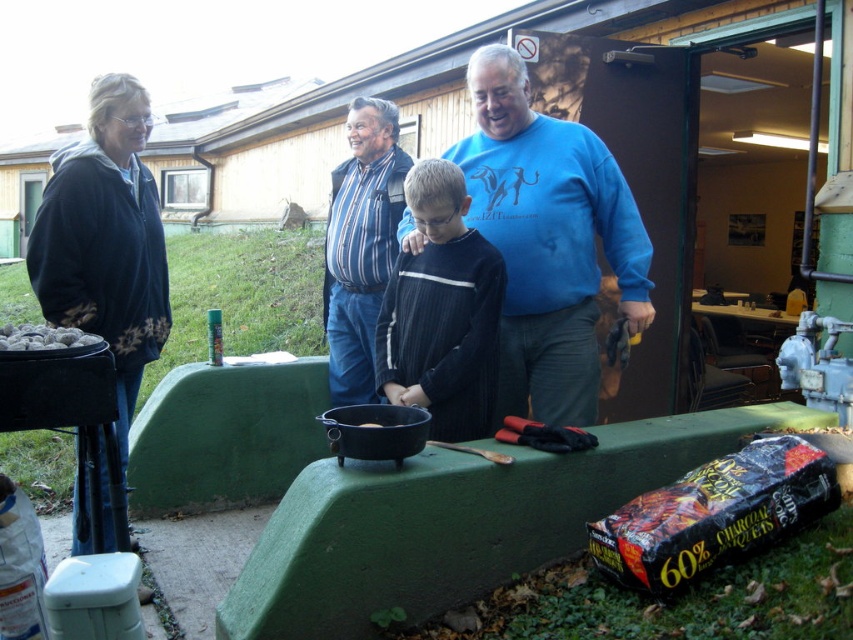
Question: Can you confirm if blue cotton sweater at center is wider than smooth gray stones at lower left?

Choices:
 (A) no
 (B) yes

Answer: (B)

Question: Which object is the farthest from the dark blue ribbed sweater at center?

Choices:
 (A) smooth gray stones at lower left
 (B) striped fabric shirt at center
 (C) blue cotton sweater at center

Answer: (A)

Question: Which point is farther to the camera?

Choices:
 (A) blue cotton sweater at center
 (B) striped fabric shirt at center

Answer: (B)

Question: Where is dark blue ribbed sweater at center located in relation to black matte pot at center in the image?

Choices:
 (A) right
 (B) left

Answer: (A)

Question: Based on their relative distances, which object is farther from the striped fabric shirt at center?

Choices:
 (A) smooth gray stones at lower left
 (B) black matte pot at center

Answer: (A)

Question: Does blue cotton sweater at center appear over black matte pot at center?

Choices:
 (A) no
 (B) yes

Answer: (B)